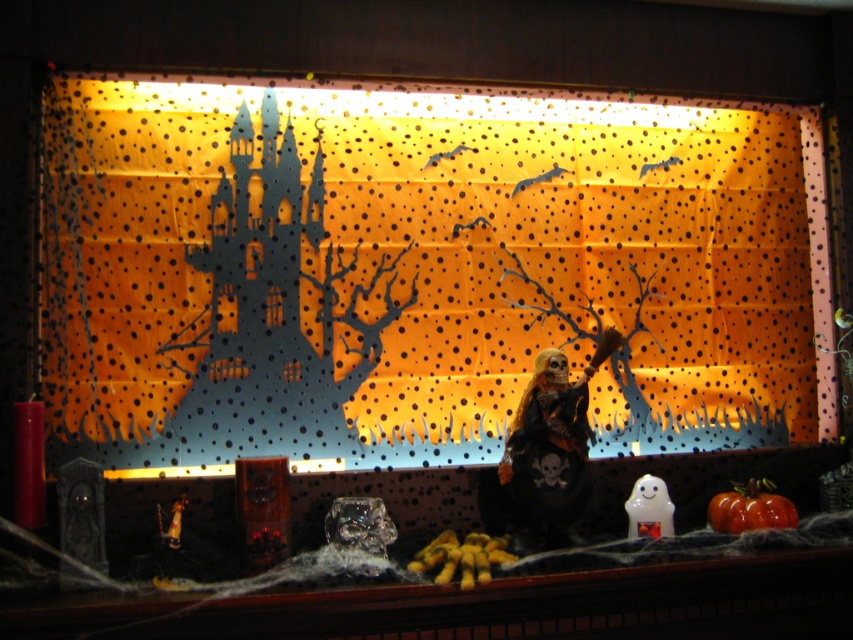
Question: Is matte black skeleton at center wider than orange matte pumpkin at lower right?

Choices:
 (A) no
 (B) yes

Answer: (B)

Question: From the image, what is the correct spatial relationship of matte black skeleton at center in relation to orange matte pumpkin at lower right?

Choices:
 (A) above
 (B) below

Answer: (A)

Question: Can you confirm if matte black skeleton at center is positioned to the left of orange matte pumpkin at lower right?

Choices:
 (A) no
 (B) yes

Answer: (B)

Question: Among these points, which one is nearest to the camera?

Choices:
 (A) (312, 170)
 (B) (737, 518)

Answer: (B)